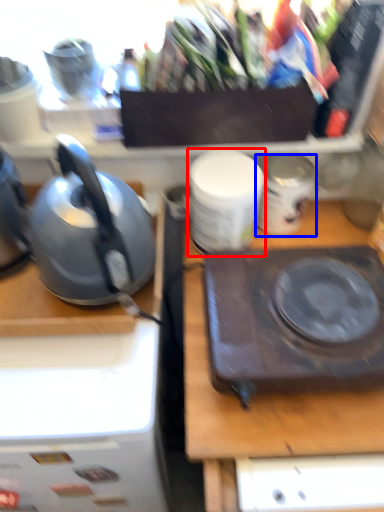
Question: Which point is closer to the camera, tableware (highlighted by a red box) or appliance (highlighted by a blue box)?

Choices:
 (A) tableware
 (B) appliance

Answer: (A)